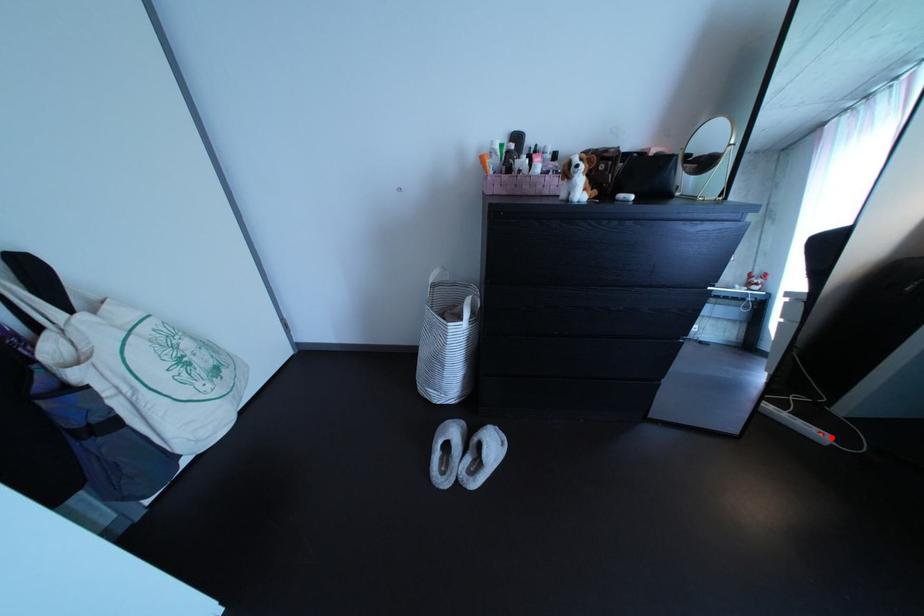
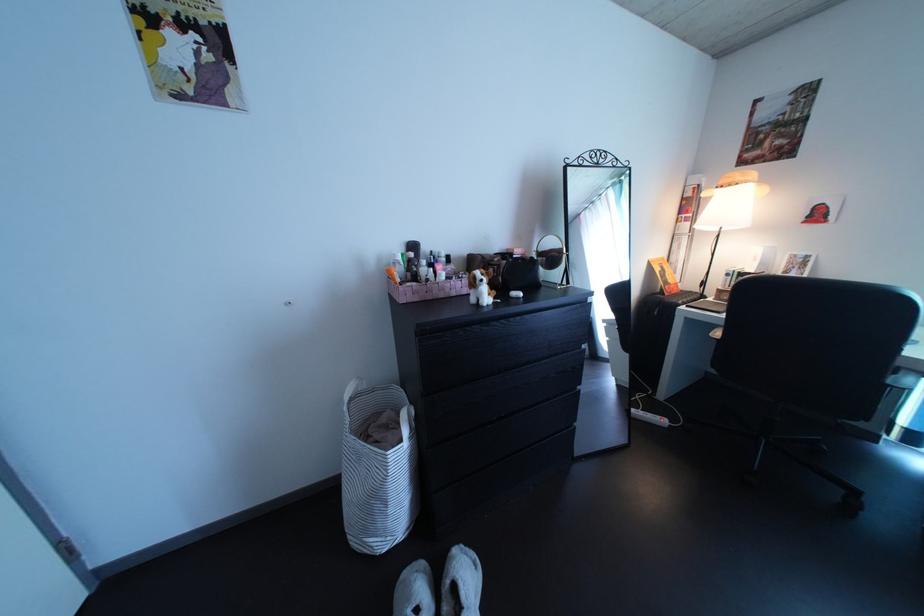
Question: I am providing you with two images of the same scene from different viewpoints. A red point is shown in image1. For the corresponding object point in image2, is it positioned nearer or farther from the camera?

Choices:
 (A) Nearer
 (B) Farther

Answer: (B)